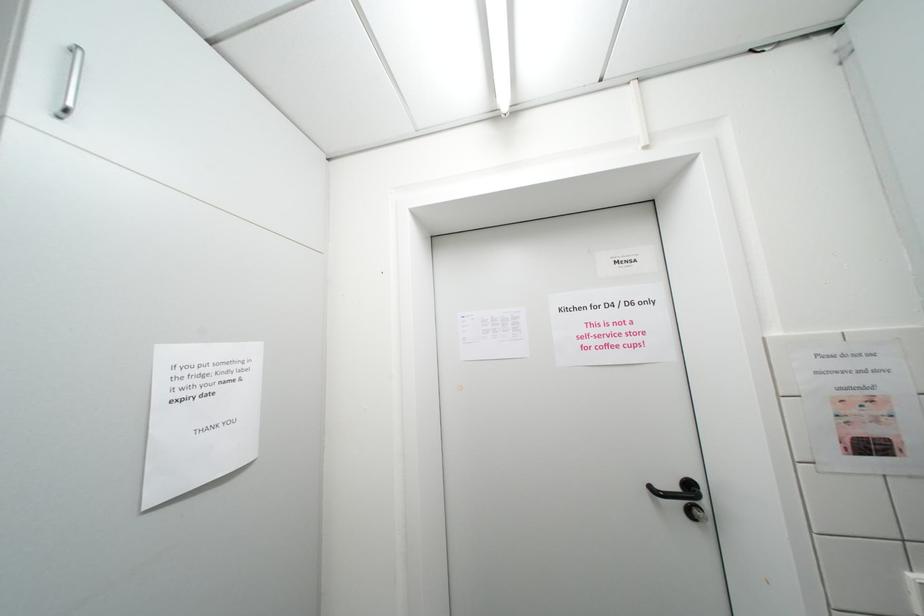
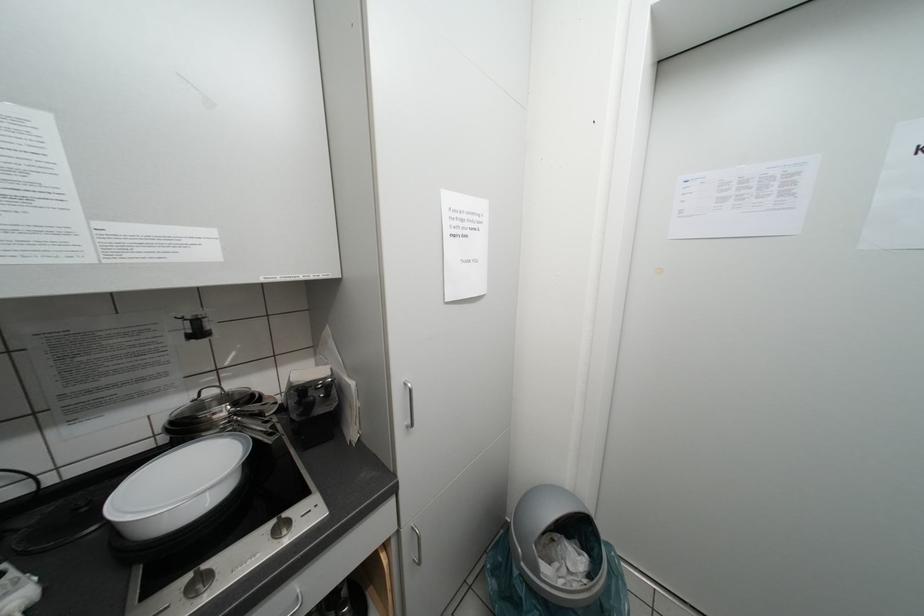
Based on the continuous images, in which direction is the camera rotating?

The rotation direction of the camera is left-down.